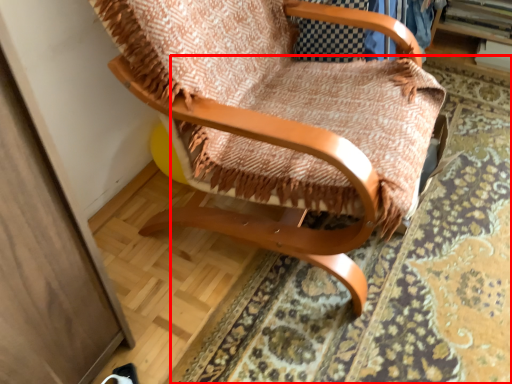
Question: In this image, where is mat (annotated by the red box) located relative to chair?

Choices:
 (A) right
 (B) left

Answer: (A)